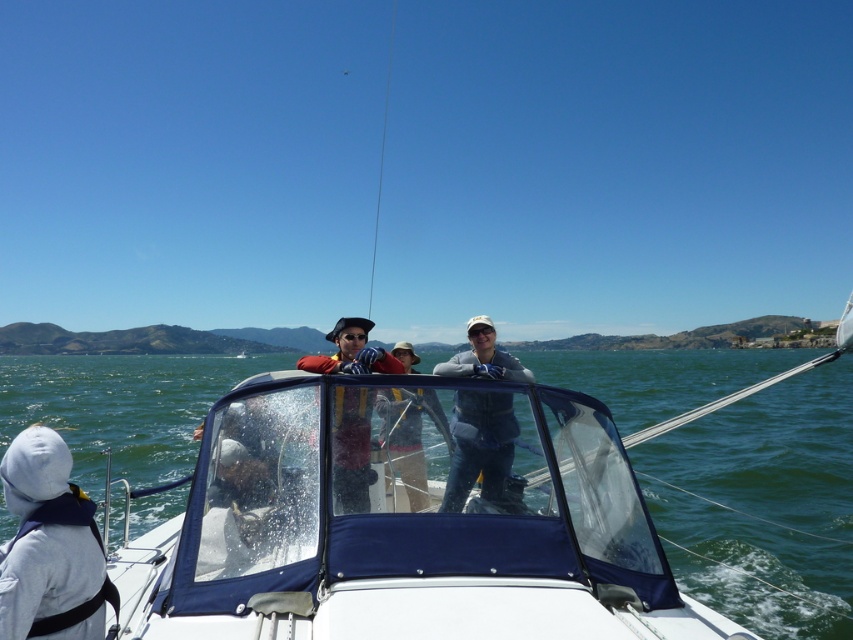
Question: Which object is closer to the camera taking this photo?

Choices:
 (A) white fleece jacket at lower left
 (B) denim jacket at center

Answer: (A)

Question: Is white fleece jacket at lower left positioned before matte orange life vest at center?

Choices:
 (A) no
 (B) yes

Answer: (B)

Question: Can you confirm if matte orange life vest at center is positioned to the right of denim jacket at center?

Choices:
 (A) no
 (B) yes

Answer: (A)

Question: Which point is farther to the camera?

Choices:
 (A) (488, 392)
 (B) (351, 349)
 (C) (447, 428)

Answer: (B)

Question: Based on their relative distances, which object is farther from the matte orange life vest at center?

Choices:
 (A) white fleece jacket at lower left
 (B) gray fabric jacket at center

Answer: (A)

Question: Is gray fabric jacket at center thinner than denim jacket at center?

Choices:
 (A) no
 (B) yes

Answer: (A)